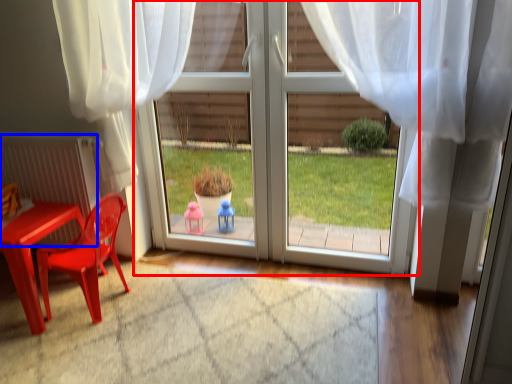
Question: Which point is closer to the camera, door (highlighted by a red box) or radiator (highlighted by a blue box)?

Choices:
 (A) door
 (B) radiator

Answer: (A)